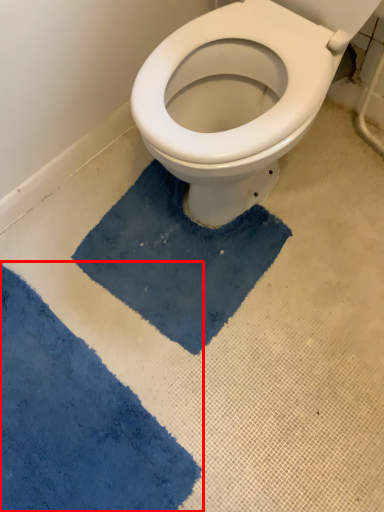
Question: From the image's perspective, what is the correct spatial positioning of bath mat (annotated by the red box) in reference to bath mat?

Choices:
 (A) below
 (B) above

Answer: (A)